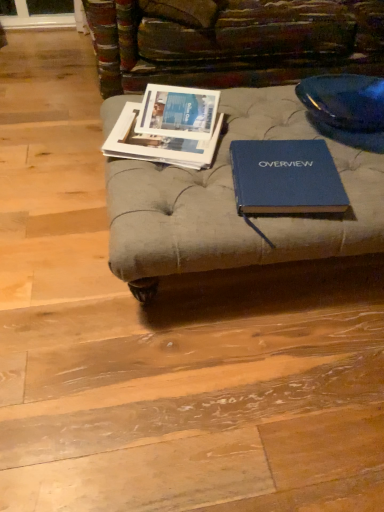
Describe the element at coordinates (286, 178) in the screenshot. The image size is (384, 512). I see `blue hardcover book at center, which is counted as the 1th book, starting from the right` at that location.

Describe the element at coordinates (158, 143) in the screenshot. Image resolution: width=384 pixels, height=512 pixels. I see `matte paper magazines at center left, placed as the 2th book when sorted from right to left` at that location.

What is the approximate width of matte paper magazine at center?

matte paper magazine at center is 7.67 inches in width.

At what (x,y) coordinates should I click in order to perform the action: click on blue hardcover book at center, which is counted as the 1th book, starting from the right. Please return your answer as a coordinate pair (x, y). The width and height of the screenshot is (384, 512). Looking at the image, I should click on (286, 178).

Visually, is matte paper magazines at center left, the 1th book in the left-to-right sequence, positioned to the left or to the right of matte paper magazine at center?

matte paper magazines at center left, the 1th book in the left-to-right sequence, is to the left of matte paper magazine at center.

In the scene shown: Is matte paper magazines at center left, placed as the 2th book when sorted from right to left, outside of matte paper magazine at center?

matte paper magazines at center left, placed as the 2th book when sorted from right to left, lies outside matte paper magazine at center's area.

Does matte paper magazines at center left, the 1th book in the left-to-right sequence, come behind matte paper magazine at center?

That is False.

Where is `book that is the 1st one when counting forward from the matte paper magazine at center`? The height and width of the screenshot is (512, 384). book that is the 1st one when counting forward from the matte paper magazine at center is located at coordinates (158, 143).

Considering the sizes of objects matte paper magazine at center and blue hardcover book at center, the second book viewed from the left, in the image provided, who is smaller, matte paper magazine at center or blue hardcover book at center, the second book viewed from the left,?

matte paper magazine at center is smaller.

From a real-world perspective, between matte paper magazine at center and blue hardcover book at center, the second book viewed from the left, who is vertically higher?

matte paper magazine at center.

Is matte paper magazine at center taller than blue hardcover book at center, which is counted as the 1th book, starting from the right?

Indeed, matte paper magazine at center has a greater height compared to blue hardcover book at center, which is counted as the 1th book, starting from the right.

Does matte paper magazine at center lie in front of blue hardcover book at center, the second book viewed from the left?

No, the depth of matte paper magazine at center is greater than that of blue hardcover book at center, the second book viewed from the left.

Considering the relative positions of blue hardcover book at center, the second book viewed from the left, and matte paper magazine at center in the image provided, is blue hardcover book at center, the second book viewed from the left, to the right of matte paper magazine at center from the viewer's perspective?

Yes, blue hardcover book at center, the second book viewed from the left, is to the right of matte paper magazine at center.

In the scene shown: Which point is more distant from viewer, (290, 195) or (173, 126)?

The point (173, 126) is behind.

Which book is the 2nd one when counting from the front of the matte paper magazine at center? Please provide its 2D coordinates.

[(286, 178)]

Between blue hardcover book at center, the second book viewed from the left, and matte paper magazine at center, which one is positioned behind?

matte paper magazine at center is more distant.

How far apart are blue hardcover book at center, which is counted as the 1th book, starting from the right, and matte paper magazines at center left, placed as the 2th book when sorted from right to left?

blue hardcover book at center, which is counted as the 1th book, starting from the right, and matte paper magazines at center left, placed as the 2th book when sorted from right to left, are 9.01 inches apart from each other.

Which of these two, blue hardcover book at center, the second book viewed from the left, or matte paper magazines at center left, placed as the 2th book when sorted from right to left, is wider?

Wider between the two is matte paper magazines at center left, placed as the 2th book when sorted from right to left.

From a real-world perspective, who is located lower, blue hardcover book at center, which is counted as the 1th book, starting from the right, or matte paper magazines at center left, the 1th book in the left-to-right sequence?

From a 3D spatial view, matte paper magazines at center left, the 1th book in the left-to-right sequence, is below.

What are the coordinates of `book located above the blue hardcover book at center, the second book viewed from the left (from the image's perspective)` in the screenshot? It's located at (158, 143).

Who is bigger, matte paper magazine at center or matte paper magazines at center left, placed as the 2th book when sorted from right to left?

Bigger between the two is matte paper magazines at center left, placed as the 2th book when sorted from right to left.

Is matte paper magazine at center to the right of matte paper magazines at center left, placed as the 2th book when sorted from right to left, from the viewer's perspective?

Correct, you'll find matte paper magazine at center to the right of matte paper magazines at center left, placed as the 2th book when sorted from right to left.

Based on the photo, from the image's perspective, which one is positioned lower, matte paper magazine at center or matte paper magazines at center left, the 1th book in the left-to-right sequence?

From the image's view, matte paper magazines at center left, the 1th book in the left-to-right sequence, is below.

Choose the correct answer: Is matte paper magazines at center left, the 1th book in the left-to-right sequence, inside blue hardcover book at center, the second book viewed from the left, or outside it?

matte paper magazines at center left, the 1th book in the left-to-right sequence, cannot be found inside blue hardcover book at center, the second book viewed from the left.

From a real-world perspective, which is physically below, matte paper magazines at center left, the 1th book in the left-to-right sequence, or blue hardcover book at center, which is counted as the 1th book, starting from the right?

matte paper magazines at center left, the 1th book in the left-to-right sequence, from a real-world perspective.

Between matte paper magazines at center left, the 1th book in the left-to-right sequence, and blue hardcover book at center, the second book viewed from the left, which one has larger width?

matte paper magazines at center left, the 1th book in the left-to-right sequence.

Are matte paper magazines at center left, the 1th book in the left-to-right sequence, and blue hardcover book at center, which is counted as the 1th book, starting from the right, beside each other?

matte paper magazines at center left, the 1th book in the left-to-right sequence, and blue hardcover book at center, which is counted as the 1th book, starting from the right, are clearly separated.

In order to click on the 1st book below the matte paper magazine at center (from the image's perspective) in this screenshot , I will do `click(158, 143)`.

This screenshot has height=512, width=384. I want to click on the 2nd book in front of the matte paper magazine at center, starting your count from the anchor, so click(286, 178).

Looking at the image, which one is located closer to blue hardcover book at center, which is counted as the 1th book, starting from the right, matte paper magazine at center or matte paper magazines at center left, the 1th book in the left-to-right sequence?

matte paper magazines at center left, the 1th book in the left-to-right sequence, is closer to blue hardcover book at center, which is counted as the 1th book, starting from the right.

Estimate the real-world distances between objects in this image. Which object is closer to blue hardcover book at center, which is counted as the 1th book, starting from the right, matte paper magazines at center left, the 1th book in the left-to-right sequence, or matte paper magazine at center?

The object closer to blue hardcover book at center, which is counted as the 1th book, starting from the right, is matte paper magazines at center left, the 1th book in the left-to-right sequence.

Estimate the real-world distances between objects in this image. Which object is further from matte paper magazines at center left, the 1th book in the left-to-right sequence, blue hardcover book at center, which is counted as the 1th book, starting from the right, or matte paper magazine at center?

blue hardcover book at center, which is counted as the 1th book, starting from the right, is further to matte paper magazines at center left, the 1th book in the left-to-right sequence.

Estimate the real-world distances between objects in this image. Which object is closer to matte paper magazines at center left, placed as the 2th book when sorted from right to left, matte paper magazine at center or blue hardcover book at center, the second book viewed from the left?

The object closer to matte paper magazines at center left, placed as the 2th book when sorted from right to left, is matte paper magazine at center.

Estimate the real-world distances between objects in this image. Which object is further from matte paper magazine at center, blue hardcover book at center, which is counted as the 1th book, starting from the right, or matte paper magazines at center left, the 1th book in the left-to-right sequence?

blue hardcover book at center, which is counted as the 1th book, starting from the right, is further to matte paper magazine at center.

Which object lies further to the anchor point matte paper magazine at center, matte paper magazines at center left, placed as the 2th book when sorted from right to left, or blue hardcover book at center, the second book viewed from the left?

The object further to matte paper magazine at center is blue hardcover book at center, the second book viewed from the left.

Where is `book cover between matte paper magazines at center left, the 1th book in the left-to-right sequence, and blue hardcover book at center, the second book viewed from the left`? The width and height of the screenshot is (384, 512). book cover between matte paper magazines at center left, the 1th book in the left-to-right sequence, and blue hardcover book at center, the second book viewed from the left is located at coordinates (178, 112).